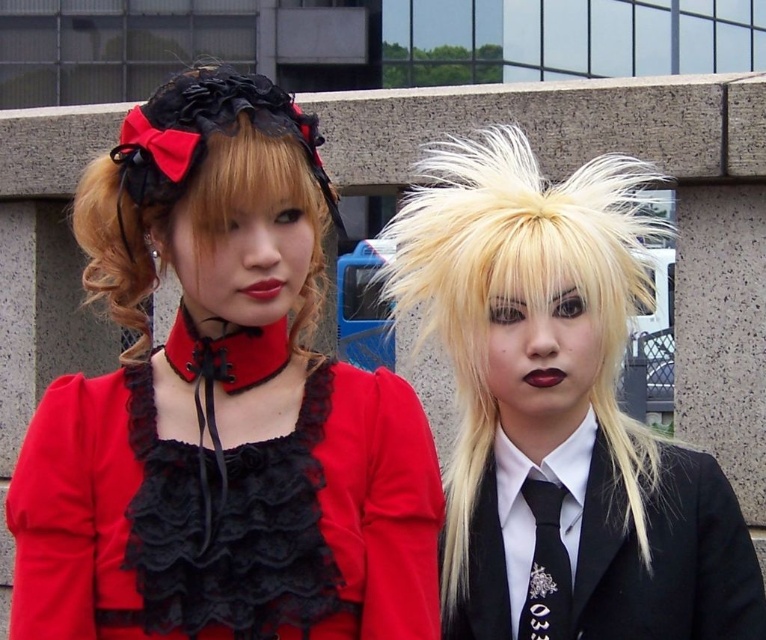
You are a photographer setting up for a photoshoot. You need to position two subjects so that they are exactly 3 meters apart. Given the current distance between the blonde curly hair at left and the black satin business suit at right, will you need to move them closer or farther apart to achieve the desired distance?

The current distance between the blonde curly hair at left and the black satin business suit at right is 2.88 meters. To reach the desired 3 meters, you need to move them slightly farther apart.

You are a photographer setting up for a shoot. You need to position a light source to the left of the blonde feathered wig at right. Based on the scene description, where should you place the light source relative to the wig?

The light source should be placed to the left of the blonde feathered wig at right, as per the photographer setup.

You are a photographer setting up for a photoshoot. You need to position a spotlight that can cover both the blonde feathered wig at right and the black lace dress at center without any obstruction. Given that the spotlight can only be angled downward from above, which object should you aim the spotlight at first to ensure both are illuminated?

The spotlight should be aimed at the blonde feathered wig at right first because it has a greater height compared to the black lace dress at center, ensuring that both objects will be illuminated when the light is adjusted downward.